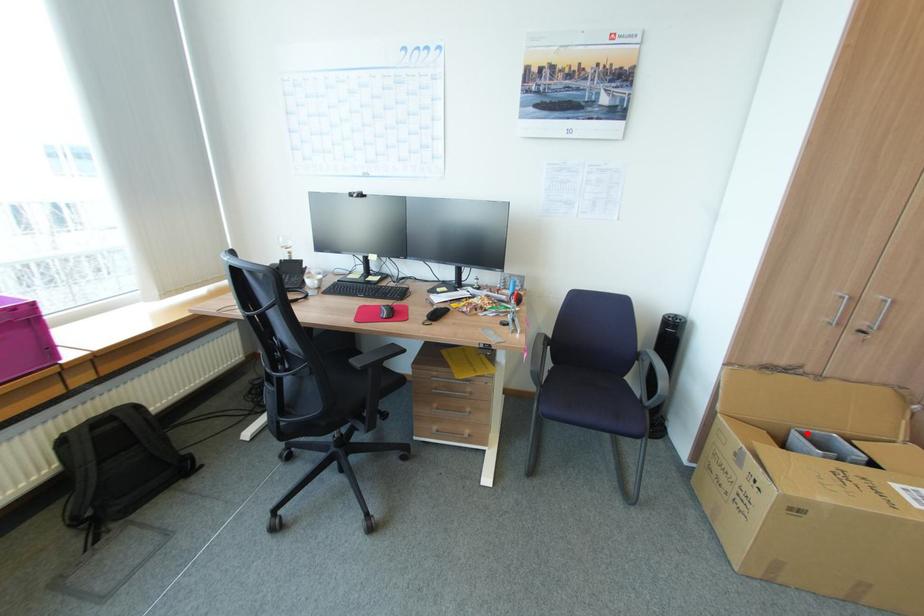
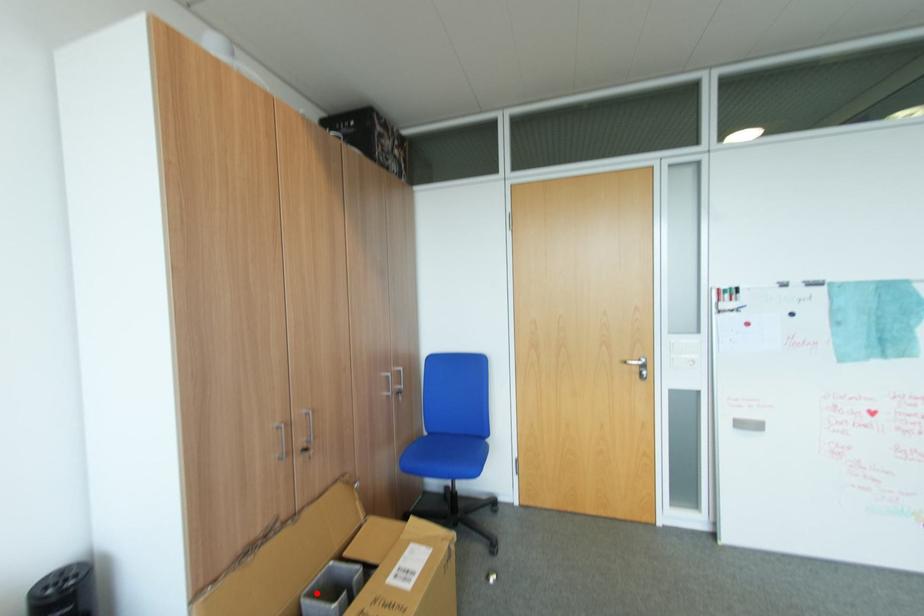
I am providing you with two images of the same scene from different viewpoints. A red point is marked on the first image and another point is marked on the second image. Is the marked point in image1 the same physical position as the marked point in image2?

Yes